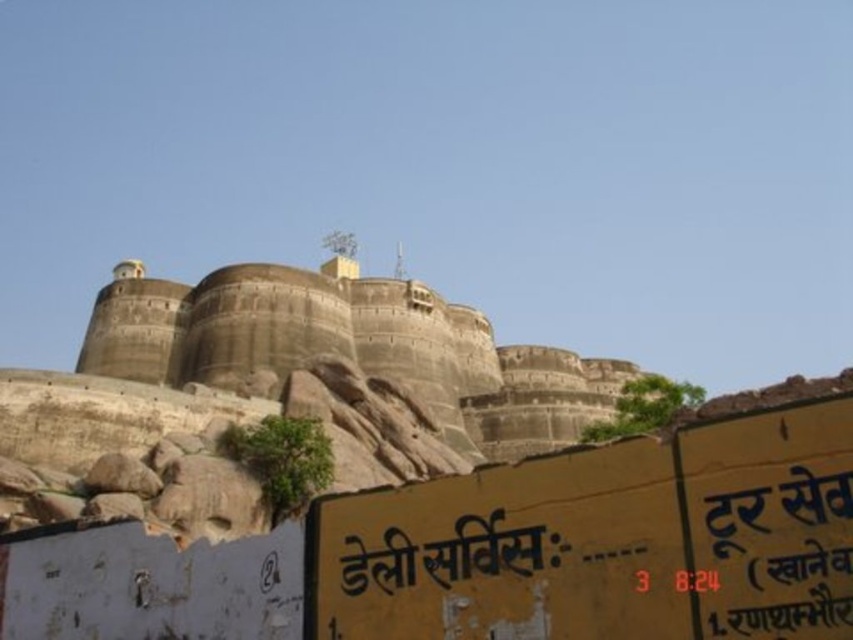
Question: Which point is farther to the camera?

Choices:
 (A) black painted signboard at lower center
 (B) gray stone castle at center

Answer: (B)

Question: Observing the image, what is the correct spatial positioning of gray stone castle at center in reference to black painted signboard at lower center?

Choices:
 (A) below
 (B) above

Answer: (B)

Question: Which point is closer to the camera?

Choices:
 (A) black painted signboard at lower center
 (B) gray stone castle at center

Answer: (A)

Question: Is gray stone castle at center bigger than black painted signboard at lower center?

Choices:
 (A) yes
 (B) no

Answer: (A)

Question: Does gray stone castle at center lie behind black painted signboard at lower center?

Choices:
 (A) yes
 (B) no

Answer: (A)